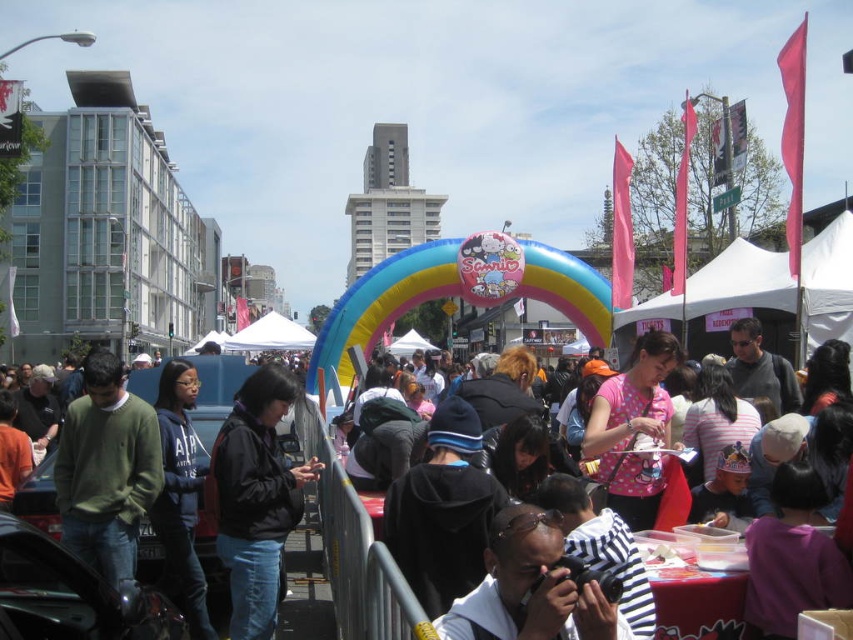
You are organizing a photo shoot and need to place two jackets on a mannequin stand. The matte black jacket at center and the black matte jacket at center must be arranged so that the wider one is on the left. Which jacket should you place on the left side of the stand?

The matte black jacket at center should be placed on the left side of the stand because it is wider than the black matte jacket at center.

You are a photographer positioned at the matte black jacket at center and want to capture a wide shot that includes the black matte jacket at center. What is the minimum distance your camera needs to cover to include both subjects?

The minimum distance your camera needs to cover is 5.08 meters between matte black jacket at center and black matte jacket at center to include both subjects.